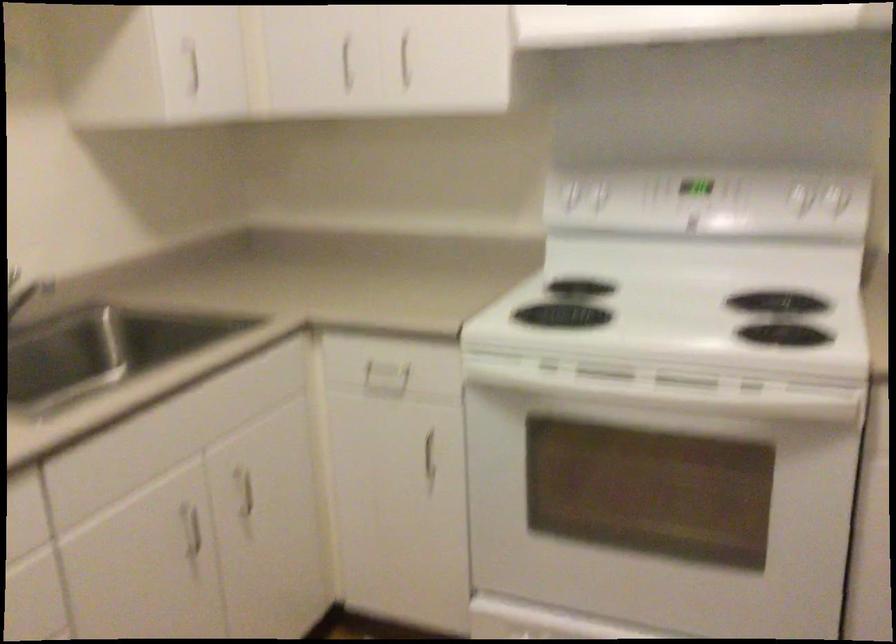
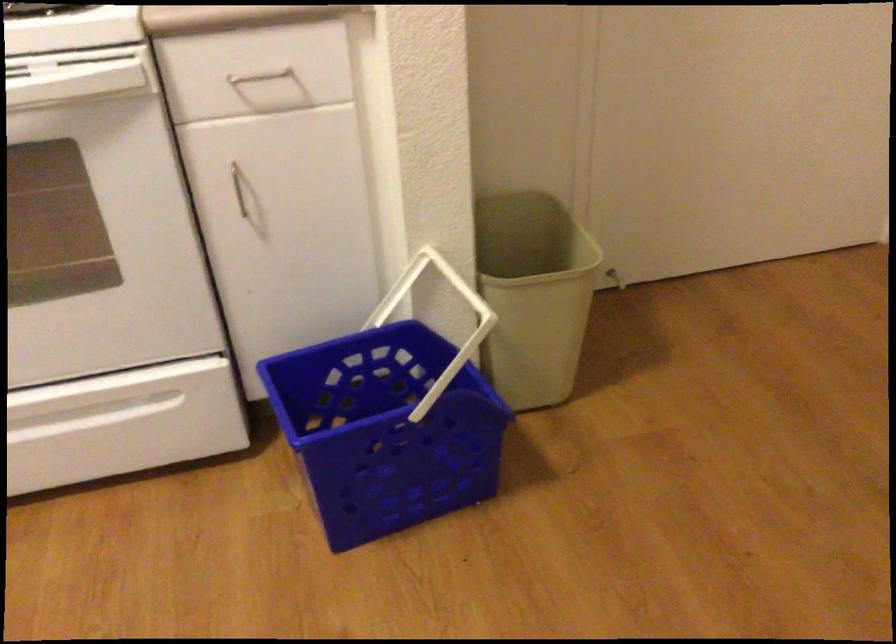
The images are taken continuously from a first-person perspective. In which direction is your viewpoint rotating?

The camera rotated toward right-down.